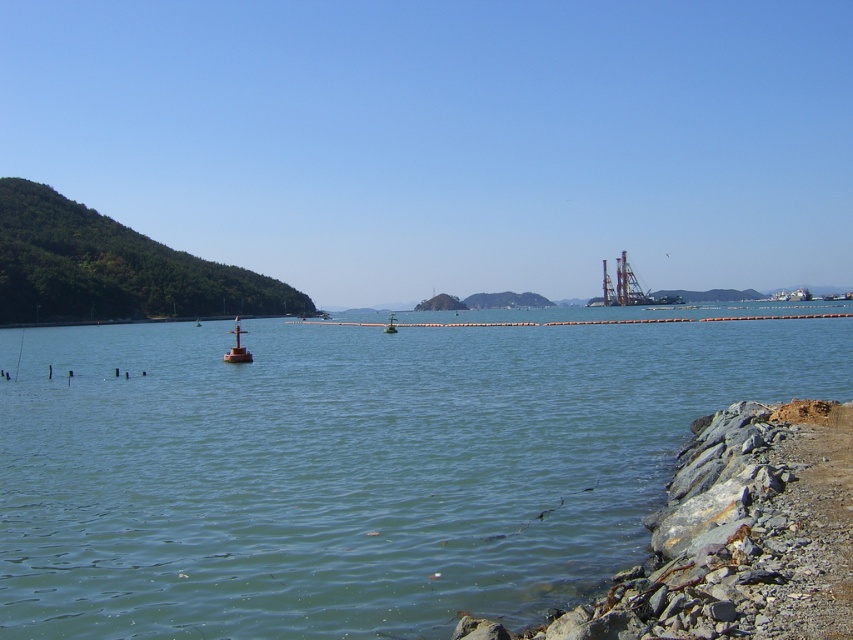
Question: Which of the following is the closest to the observer?

Choices:
 (A) (608, 419)
 (B) (229, 356)
 (C) (651, 296)
 (D) (392, 317)

Answer: (A)

Question: Is metallic gray drilling rig at center right to the right of green matte buoy at center from the viewer's perspective?

Choices:
 (A) yes
 (B) no

Answer: (A)

Question: Does green water at center have a smaller size compared to green matte buoy at center?

Choices:
 (A) no
 (B) yes

Answer: (A)

Question: Does metallic gray drilling rig at center right have a smaller size compared to green matte buoy at center?

Choices:
 (A) yes
 (B) no

Answer: (B)

Question: Considering the real-world distances, which object is closest to the smooth orange buoy at center?

Choices:
 (A) green water at center
 (B) metallic gray drilling rig at center right
 (C) green matte buoy at center

Answer: (A)

Question: Based on their relative distances, which object is nearer to the metallic gray drilling rig at center right?

Choices:
 (A) smooth orange buoy at center
 (B) green matte buoy at center
 (C) green water at center

Answer: (B)